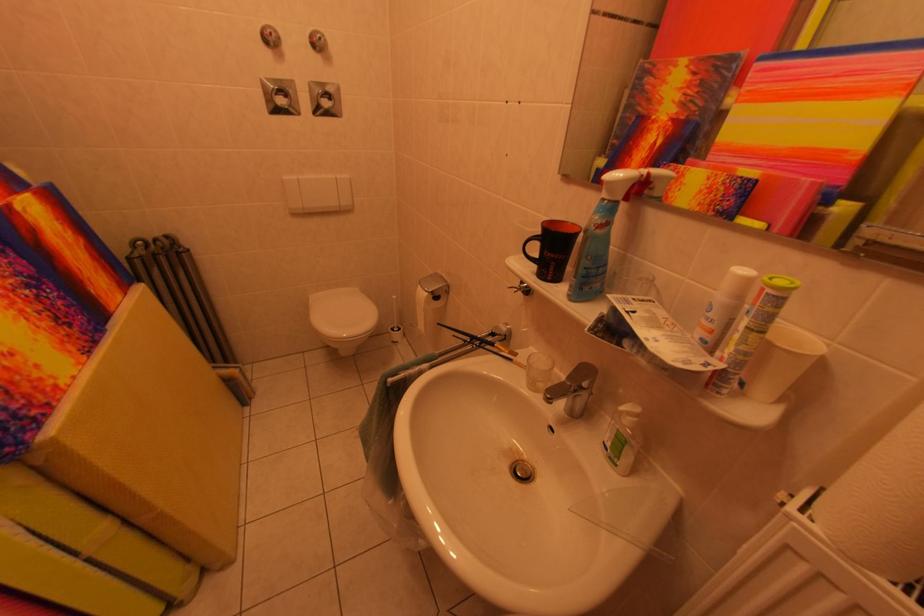
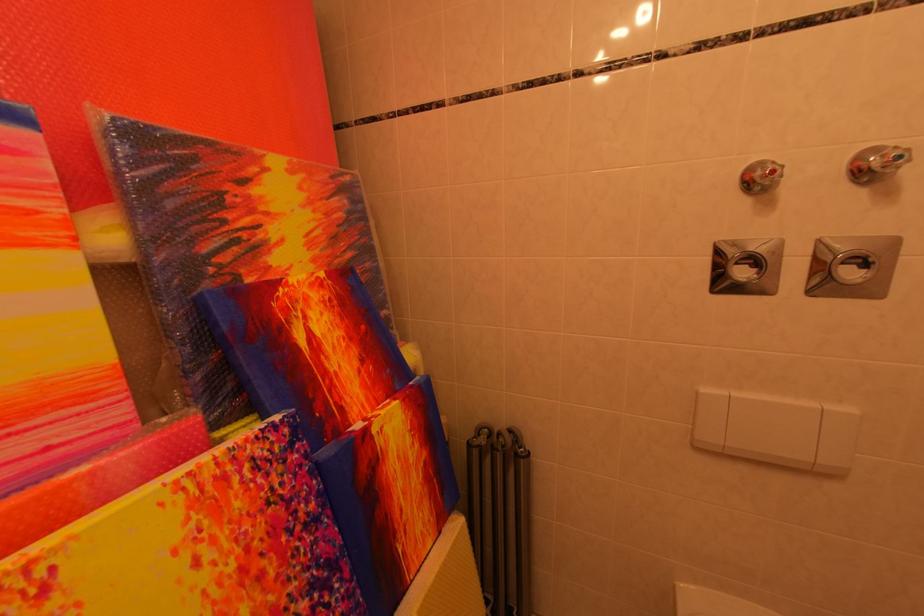
Locate, in the second image, the point that corresponds to [327,44] in the first image.

(907, 161)